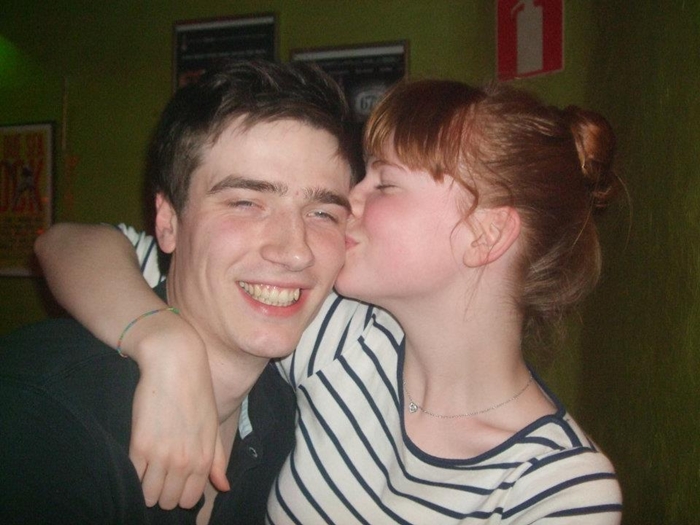
At what (x,y) coordinates should I click in order to perform the action: click on green wall. Please return your answer as a coordinate pair (x, y). Looking at the image, I should click on (652, 380).